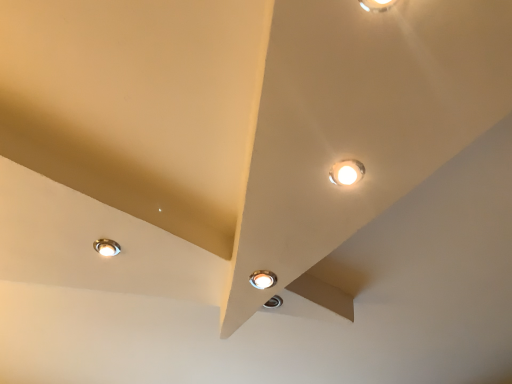
Question: Is matte silver lamp at center, which is the second lamp from right to left, next to matte white lamp at upper right, arranged as the 1th lamp when viewed from the right?

Choices:
 (A) no
 (B) yes

Answer: (A)

Question: From the image's perspective, is matte silver lamp at center, the 3th lamp viewed from the top, above matte white lamp at upper right, arranged as the 1th lamp when viewed from the right?

Choices:
 (A) no
 (B) yes

Answer: (A)

Question: Is matte silver lamp at center, which is the second lamp from right to left, facing away from matte white lamp at upper right, arranged as the 1th lamp when viewed from the top?

Choices:
 (A) yes
 (B) no

Answer: (B)

Question: Is matte silver lamp at center, positioned as the second lamp in left-to-right order, further to camera compared to matte white lamp at upper right, the 3th lamp when ordered from left to right?

Choices:
 (A) yes
 (B) no

Answer: (A)

Question: From a real-world perspective, is matte silver lamp at center, which is the second lamp in back-to-front order, on matte white lamp at upper right, arranged as the third lamp when viewed from the back?

Choices:
 (A) yes
 (B) no

Answer: (B)

Question: Looking at their shapes, would you say matte silver lamp at lower left, the third lamp positioned from the front, is wider or thinner than matte white lamp at upper right, arranged as the 1th lamp when viewed from the right?

Choices:
 (A) wide
 (B) thin

Answer: (A)

Question: Is point (117, 246) closer or farther from the camera than point (350, 178)?

Choices:
 (A) closer
 (B) farther

Answer: (B)

Question: From the image's perspective, is matte silver lamp at lower left, the third lamp positioned from the front, positioned above or below matte white lamp at upper right, the 3th lamp when ordered from left to right?

Choices:
 (A) below
 (B) above

Answer: (A)

Question: In terms of height, does matte silver lamp at lower left, which is the 1th lamp from left to right, look taller or shorter compared to matte white lamp at upper right, the first lamp positioned from the front?

Choices:
 (A) short
 (B) tall

Answer: (B)

Question: From a real-world perspective, relative to matte silver lamp at lower left, the third lamp positioned from the front, is matte white lamp at upper right, arranged as the third lamp when viewed from the back, vertically above or below?

Choices:
 (A) below
 (B) above

Answer: (A)

Question: Considering their positions, is matte white lamp at upper right, arranged as the third lamp when viewed from the back, located in front of or behind matte silver lamp at lower left, which appears as the first lamp when viewed from the back?

Choices:
 (A) behind
 (B) front

Answer: (B)

Question: In terms of height, does matte white lamp at upper right, the first lamp positioned from the front, look taller or shorter compared to matte silver lamp at lower left, the 2th lamp positioned from the bottom?

Choices:
 (A) short
 (B) tall

Answer: (A)

Question: From the image's perspective, is matte white lamp at upper right, arranged as the 1th lamp when viewed from the right, positioned above or below matte silver lamp at lower left, the 2th lamp positioned from the top?

Choices:
 (A) above
 (B) below

Answer: (A)

Question: Looking at their shapes, would you say matte white lamp at upper right, placed as the third lamp when sorted from bottom to top, is wider or thinner than matte silver lamp at center, acting as the first lamp starting from the bottom?

Choices:
 (A) thin
 (B) wide

Answer: (A)

Question: Would you say matte white lamp at upper right, arranged as the third lamp when viewed from the back, is to the left or to the right of matte silver lamp at center, acting as the first lamp starting from the bottom, in the picture?

Choices:
 (A) right
 (B) left

Answer: (A)